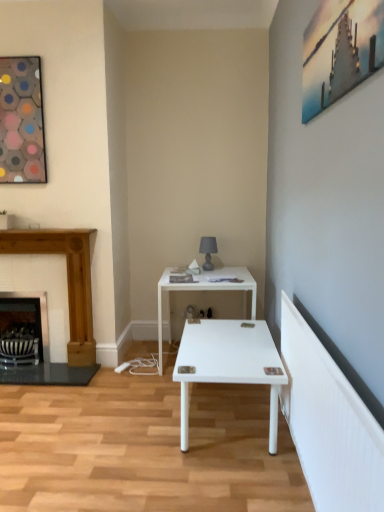
The height and width of the screenshot is (512, 384). Identify the location of free location in front of wooden fireplace at left, which appears as the second fireplace when viewed from the left. (51, 396).